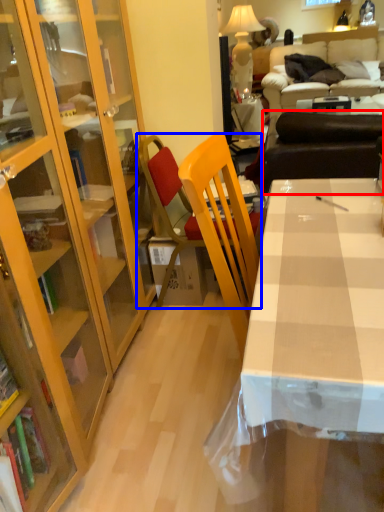
Question: Which object appears farthest to the camera in this image, studio couch (highlighted by a red box) or chair (highlighted by a blue box)?

Choices:
 (A) studio couch
 (B) chair

Answer: (A)